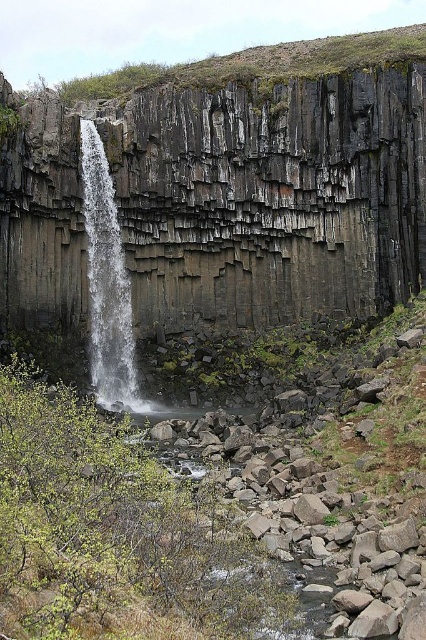
Question: Where is dark gray basalt at center located in relation to gray rocky creek at lower center in the image?

Choices:
 (A) left
 (B) right

Answer: (B)

Question: Does dark gray basalt at center appear over white textured waterfall at left?

Choices:
 (A) no
 (B) yes

Answer: (B)

Question: Estimate the real-world distances between objects in this image. Which object is closer to the dark gray basalt at center?

Choices:
 (A) white textured waterfall at left
 (B) gray rocky creek at lower center

Answer: (A)

Question: Considering the real-world distances, which object is closest to the gray rocky creek at lower center?

Choices:
 (A) dark gray basalt at center
 (B) white textured waterfall at left

Answer: (B)

Question: Which of the following is the farthest from the observer?

Choices:
 (A) (132, 360)
 (B) (129, 408)
 (C) (281, 272)

Answer: (C)

Question: Considering the relative positions of white textured waterfall at left and gray rocky creek at lower center in the image provided, where is white textured waterfall at left located with respect to gray rocky creek at lower center?

Choices:
 (A) left
 (B) right

Answer: (A)